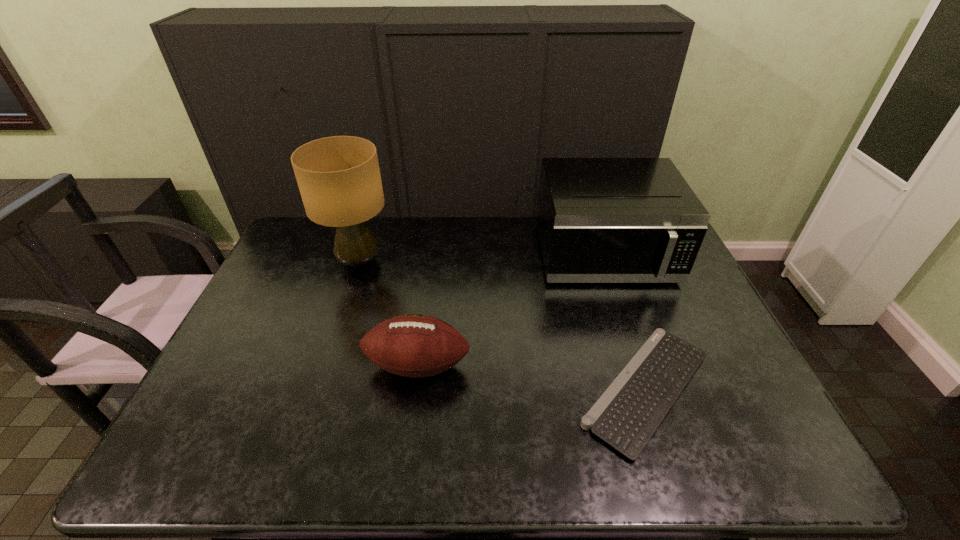
The width and height of the screenshot is (960, 540). I want to click on lampshade, so [339, 179].

In order to click on microwave_oven in this screenshot , I will do `click(600, 220)`.

Where is `football (American)`? This screenshot has width=960, height=540. football (American) is located at coordinates (413, 345).

At what (x,y) coordinates should I click in order to perform the action: click on computer keyboard. Please return your answer as a coordinate pair (x, y). This screenshot has width=960, height=540. Looking at the image, I should click on (628, 413).

Identify the location of vacant space situated on the back of the tallest object. The height and width of the screenshot is (540, 960). (371, 224).

This screenshot has width=960, height=540. Identify the location of free point located on the front-facing side of the microwave_oven. tap(629, 328).

Identify the location of vacant space situated on the back of the football (American). (432, 254).

Where is `vacant space situated 0.090m on the back of the shortest object`? vacant space situated 0.090m on the back of the shortest object is located at coordinates (620, 309).

Locate an element on the screen. This screenshot has height=540, width=960. lampshade present at the far edge is located at coordinates (339, 179).

In order to click on microwave_oven located in the far edge section of the desktop in this screenshot , I will do coord(600,220).